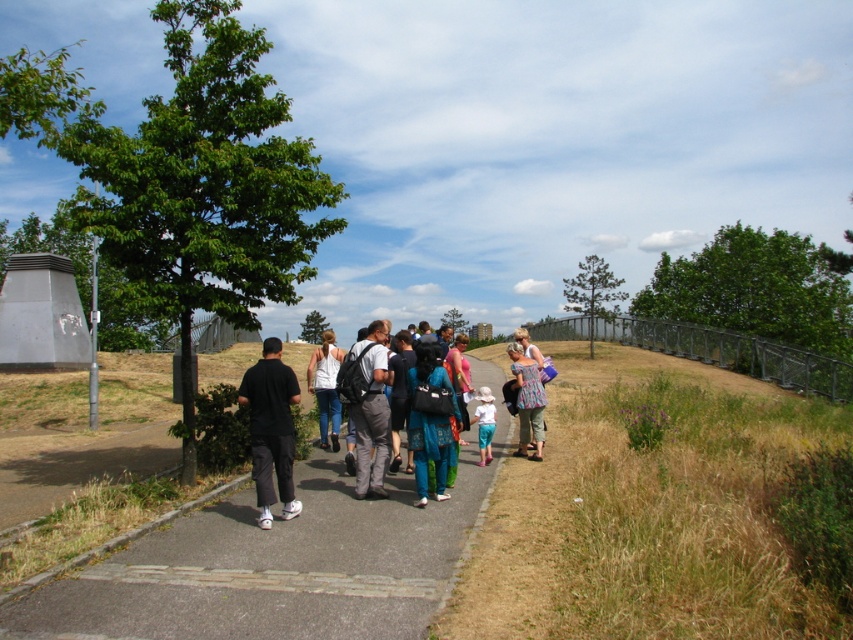
You are a photographer trying to capture a clear shot of the white cotton tank top at center without the matte black backpack at center blocking it. Based on the scene, where should you position yourself relative to the group?

Since the matte black backpack at center is in front of the white cotton tank top at center, you should position yourself behind the matte black backpack at center to ensure the white cotton tank top at center is visible without obstruction.

You are a photographer trying to capture a candid shot of the group. You notice two people wearing black matte pants at center and blue fabric dress at center. Which person do you think you can frame more easily in your camera viewfinder without adjusting your position?

The black matte pants at center is narrower than the blue fabric dress at center, so the person wearing the black matte pants at center can be framed more easily without adjusting your position.